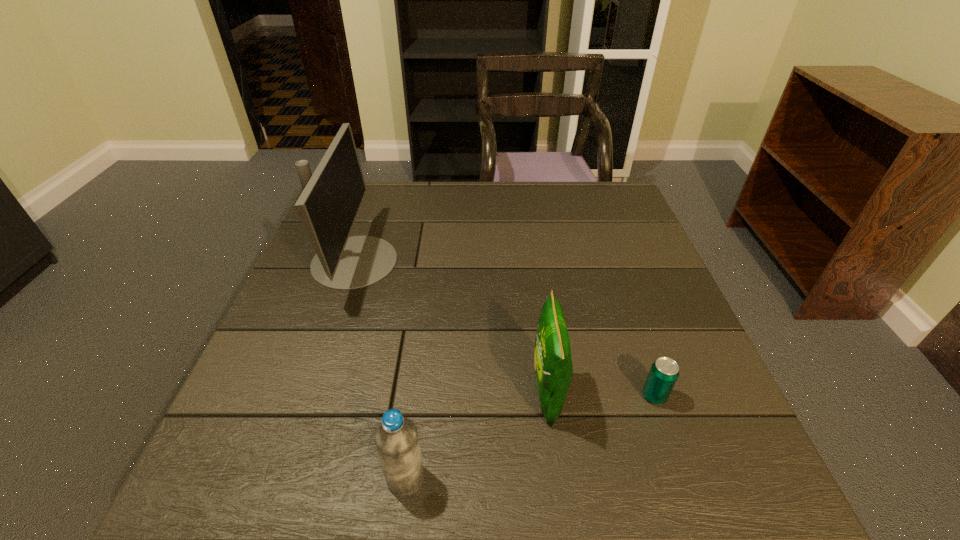
Where is `the tallest object`? the tallest object is located at coordinates (328, 206).

Where is `computer monitor`? This screenshot has width=960, height=540. computer monitor is located at coordinates (328, 206).

Identify the location of the second object from right to left. This screenshot has height=540, width=960. click(553, 365).

You are a GUI agent. You are given a task and a screenshot of the screen. Output one action in this format:
    pyautogui.click(x=<x>, y=<y>)
    Task: Click on the third object from right to left
    The width and height of the screenshot is (960, 540).
    Given the screenshot: What is the action you would take?
    (x=396, y=439)

In order to click on water bottle in this screenshot , I will do `click(396, 439)`.

Locate an element on the screen. the shortest object is located at coordinates (664, 372).

Locate an element on the screen. The image size is (960, 540). the rightmost object is located at coordinates (664, 372).

Find the location of a particular element. Image resolution: width=960 pixels, height=540 pixels. free space located on the screen of the computer monitor is located at coordinates (485, 261).

Identify the location of vacant area situated 0.260m on the front-facing side of the crisp (potato chip). (396, 394).

The height and width of the screenshot is (540, 960). I want to click on free space located on the front-facing side of the crisp (potato chip), so click(339, 394).